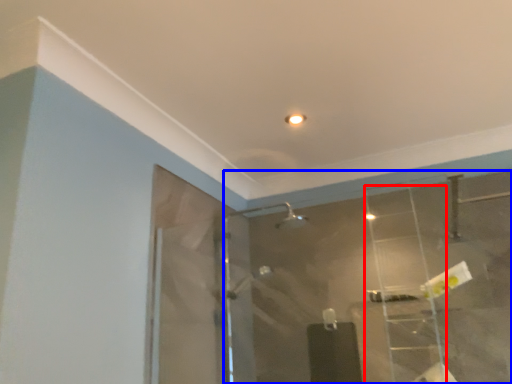
Question: Which object is closer to the camera taking this photo, ladder (highlighted by a red box) or mirror (highlighted by a blue box)?

Choices:
 (A) ladder
 (B) mirror

Answer: (B)